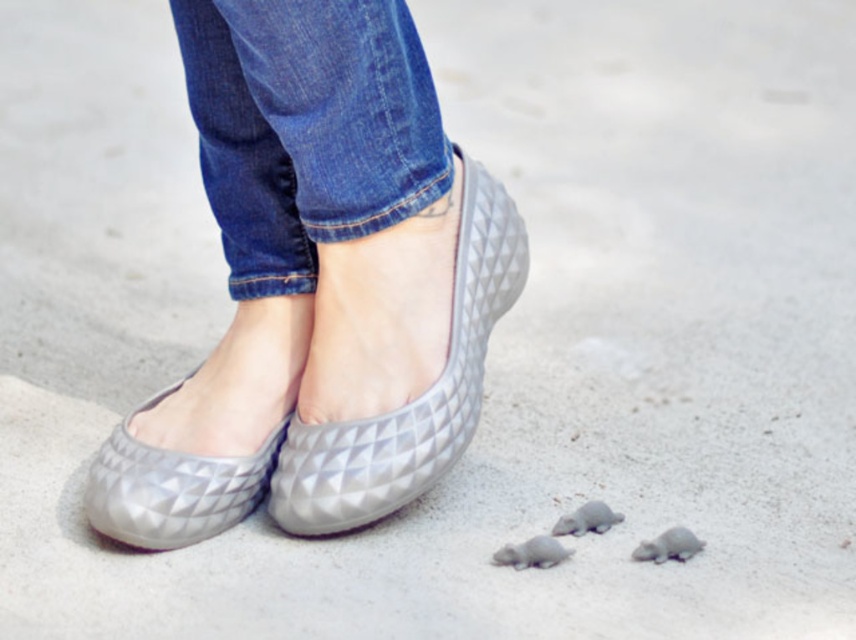
Is matte rubber mouse at lower center to the right of matte rubber mouse at lower right from the viewer's perspective?

Incorrect, matte rubber mouse at lower center is not on the right side of matte rubber mouse at lower right.

Is point (544, 556) closer to viewer compared to point (703, 544)?

Yes, point (544, 556) is closer to viewer.

Locate an element on the screen. The image size is (856, 640). matte rubber mouse at lower center is located at coordinates (531, 554).

Does matte rubber mouse at lower center appear under matte rubber turtle at lower center?

Yes, matte rubber mouse at lower center is below matte rubber turtle at lower center.

Between matte rubber mouse at lower center and matte rubber turtle at lower center, which one is positioned lower?

matte rubber mouse at lower center is below.

Does point (496, 550) come farther from viewer compared to point (569, 518)?

No, (496, 550) is closer to viewer.

The height and width of the screenshot is (640, 856). Identify the location of matte rubber mouse at lower center. (531, 554).

Who is positioned more to the right, denim at center or matte rubber mouse at lower center?

Positioned to the right is matte rubber mouse at lower center.

In the scene shown: Who is lower down, denim at center or matte rubber mouse at lower center?

matte rubber mouse at lower center is lower down.

At what (x,y) coordinates should I click in order to perform the action: click on denim at center. Please return your answer as a coordinate pair (x, y). This screenshot has width=856, height=640. Looking at the image, I should click on (307, 128).